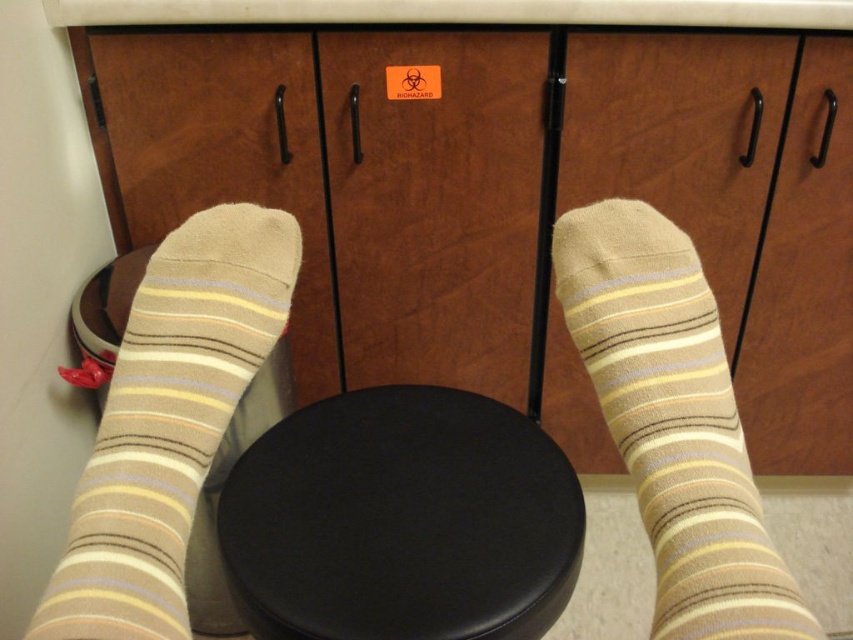
You are trying to determine if the tan striped sock at center can fit into a drawer that is the same width as the tan striped sock at lower left. Based on the scene, will it fit?

The tan striped sock at center has a smaller width than the tan striped sock at lower left. Since the drawer is the same width as the tan striped sock at lower left, the tan striped sock at center will fit into the drawer.

You are a delivery robot that needs to place a small package on the black leather stool at center. However, there is a tan striped sock at lower left nearby. Can you safely place the package on the stool without touching the sock?

The black leather stool at center and tan striped sock at lower left are 9.74 inches apart. Since the distance is sufficient, the robot can safely place the package on the stool without touching the sock.